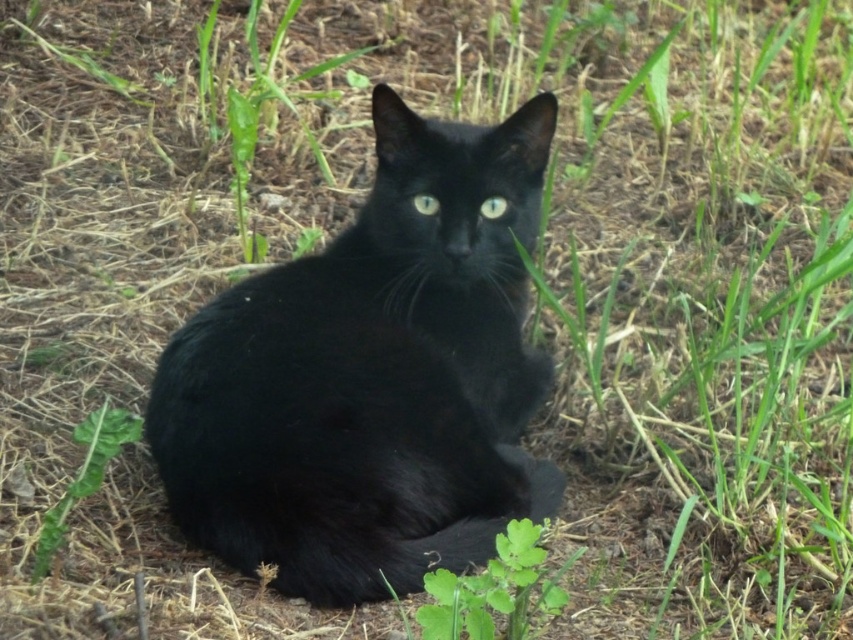
Is shiny black cat at center to the left of green leafy plant at lower center from the viewer's perspective?

Yes, shiny black cat at center is to the left of green leafy plant at lower center.

Between point (393, 388) and point (537, 525), which one is positioned in front?

Positioned in front is point (537, 525).

Where is `shiny black cat at center`? The image size is (853, 640). shiny black cat at center is located at coordinates (370, 378).

Identify the location of shiny black cat at center. (370, 378).

Which of these two, shiny black cat at center or shiny green eye at center, stands shorter?

shiny green eye at center

Who is more forward, [477,211] or [431,198]?

Point [477,211] is in front.

Who is more forward, (236, 314) or (428, 198)?

Point (236, 314) is more forward.

In order to click on shiny black cat at center in this screenshot , I will do `click(370, 378)`.

Who is more forward, (508, 572) or (109, 420)?

Positioned in front is point (508, 572).

Between point (428, 618) and point (122, 428), which one is positioned in front?

Positioned in front is point (428, 618).

Locate an element on the screen. The height and width of the screenshot is (640, 853). green leafy plant at lower center is located at coordinates click(x=496, y=589).